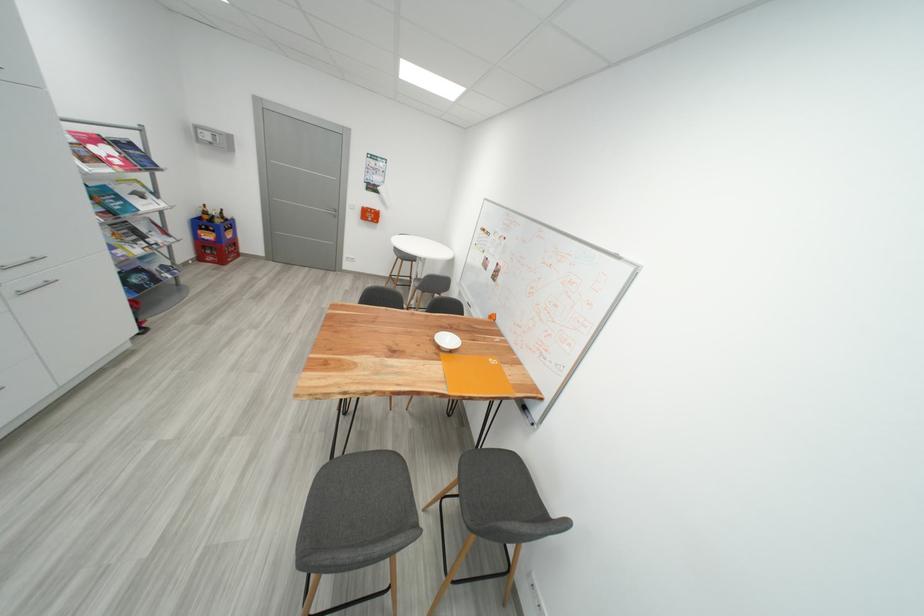
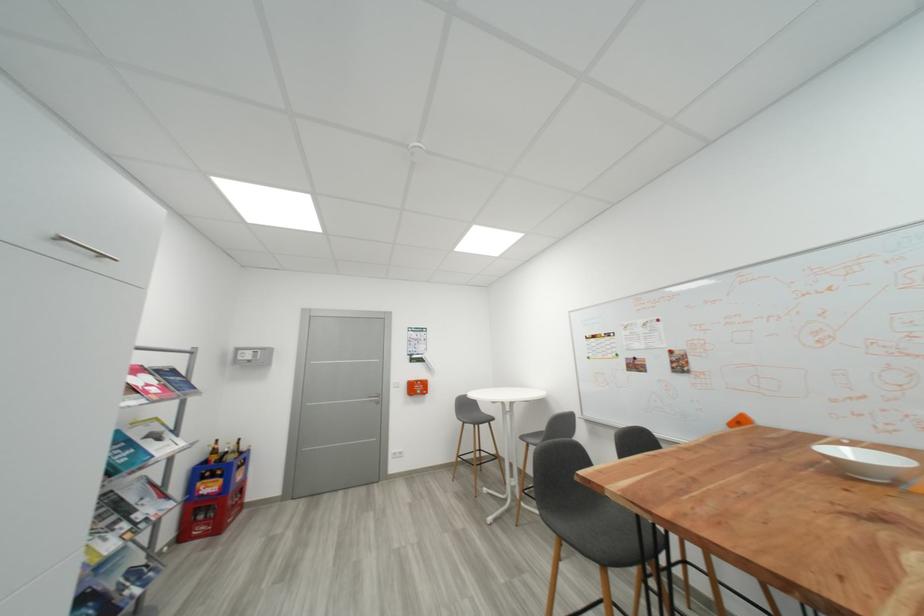
In the second image, find the point that corresponds to the point at 213,215 in the first image.

(223, 454)